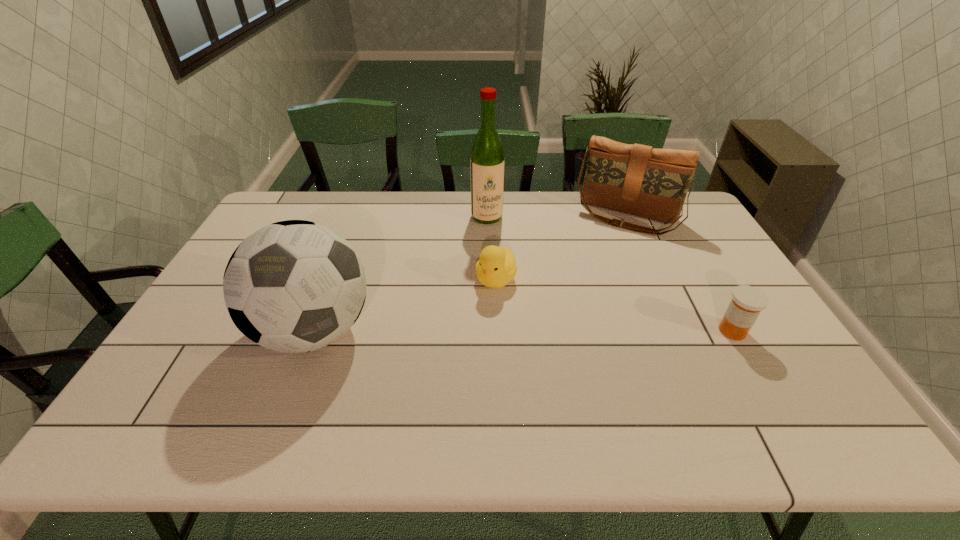
Find the location of a particular element. The width and height of the screenshot is (960, 540). free space located on the front-facing side of the third shortest object is located at coordinates (590, 283).

Image resolution: width=960 pixels, height=540 pixels. What are the coordinates of `blank space located on the front-facing side of the third shortest object` in the screenshot? It's located at (595, 273).

This screenshot has height=540, width=960. What are the coordinates of `free point located on the front-facing side of the third shortest object` in the screenshot? It's located at (578, 311).

The image size is (960, 540). Find the location of `vacant space located 0.170m on the front-facing side of the duck`. vacant space located 0.170m on the front-facing side of the duck is located at coordinates (463, 335).

At what (x,y) coordinates should I click in order to perform the action: click on vacant area situated 0.140m on the front-facing side of the duck. Please return your answer as a coordinate pair (x, y). The image size is (960, 540). Looking at the image, I should click on pos(468,327).

I want to click on free space located 0.070m on the front-facing side of the duck, so tap(478, 310).

Where is `liquor at the far edge`? This screenshot has width=960, height=540. liquor at the far edge is located at coordinates (487, 162).

The width and height of the screenshot is (960, 540). I want to click on shoulder bag at the far edge, so click(636, 179).

I want to click on object located at the near edge, so click(293, 286).

Find the location of `medicine that is at the right edge`. medicine that is at the right edge is located at coordinates (747, 302).